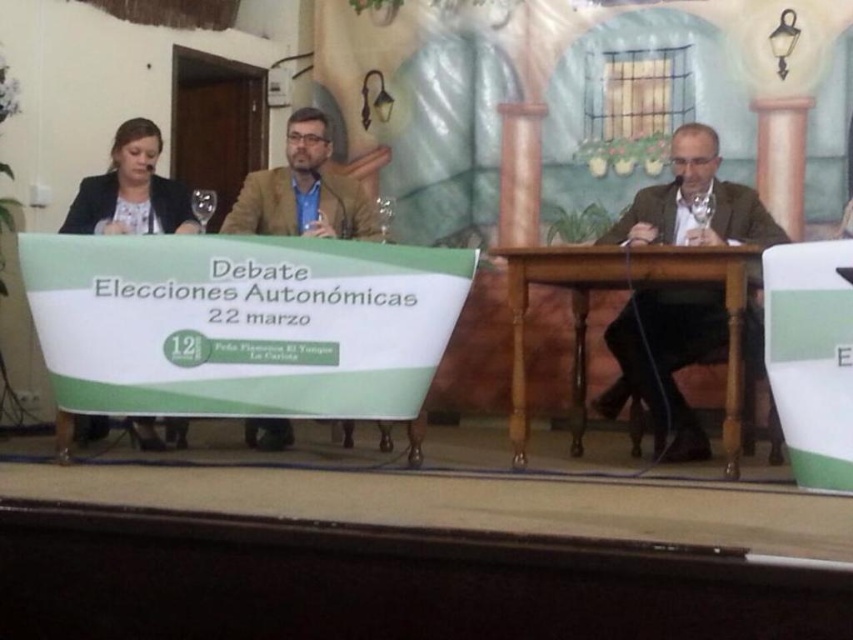
Does matte brown blazer at center appear under matte black jacket at left?

Yes.

Is matte brown blazer at center closer to camera compared to matte black jacket at left?

That is False.

At what (x,y) coordinates should I click in order to perform the action: click on matte brown blazer at center. Please return your answer as a coordinate pair (x, y). The height and width of the screenshot is (640, 853). Looking at the image, I should click on (303, 189).

Can you confirm if brown textured suit at center is smaller than matte black jacket at left?

No, brown textured suit at center is not smaller than matte black jacket at left.

The height and width of the screenshot is (640, 853). Describe the element at coordinates (664, 360) in the screenshot. I see `brown textured suit at center` at that location.

Who is more forward, (677, 328) or (120, 186)?

Positioned in front is point (677, 328).

This screenshot has width=853, height=640. Find the location of `brown textured suit at center`. brown textured suit at center is located at coordinates (664, 360).

Which is above, brown wooden table at center or matte brown blazer at center?

Positioned higher is matte brown blazer at center.

Identify the location of brown wooden table at center. Image resolution: width=853 pixels, height=640 pixels. (618, 289).

Identify the location of brown wooden table at center. (618, 289).